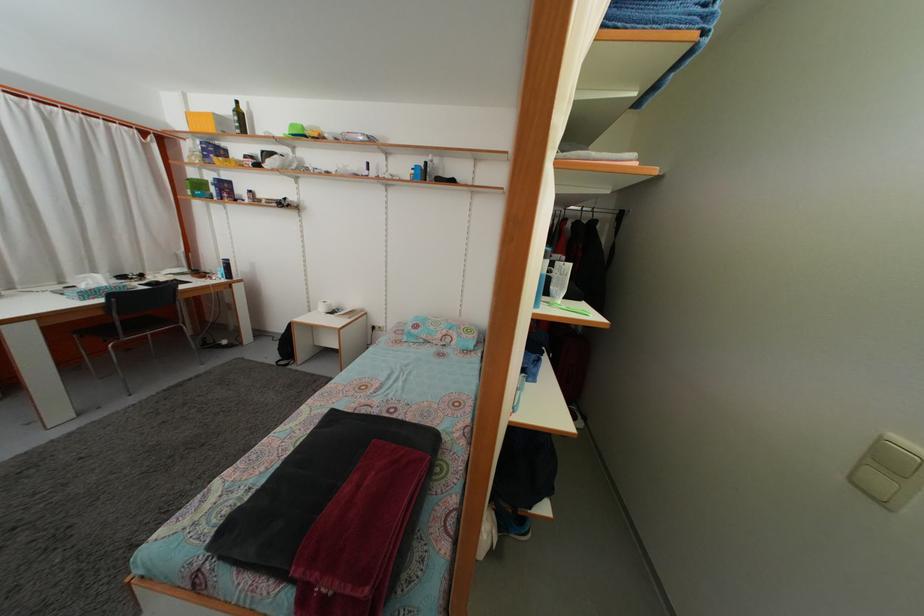
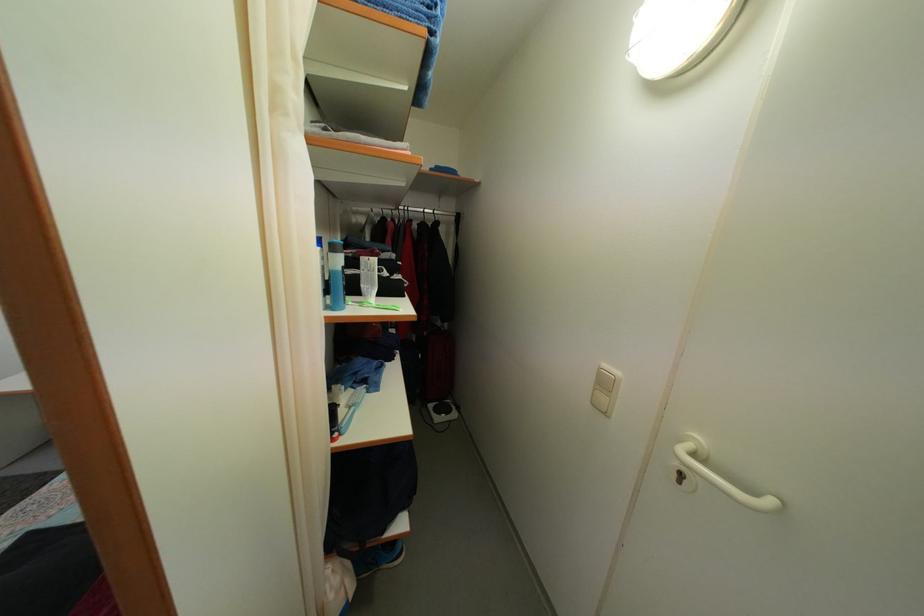
Question: The images are taken continuously from a first-person perspective. In which direction are you moving?

Choices:
 (A) Left
 (B) Right
 (C) Forward
 (D) Backward

Answer: (B)